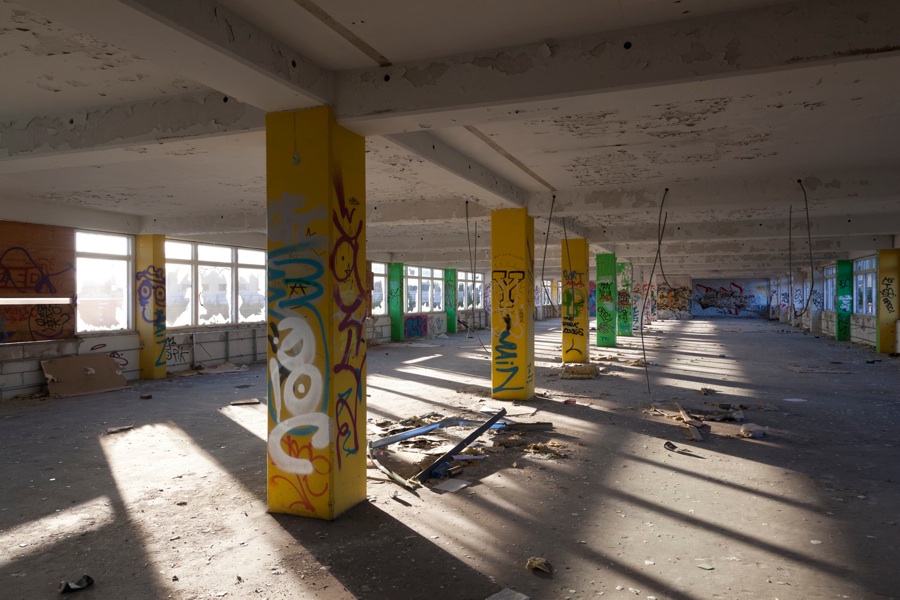
Locate an element on the screen. wires hanging from ceiling is located at coordinates (659, 244), (813, 257), (789, 260), (544, 245), (570, 261), (472, 258).